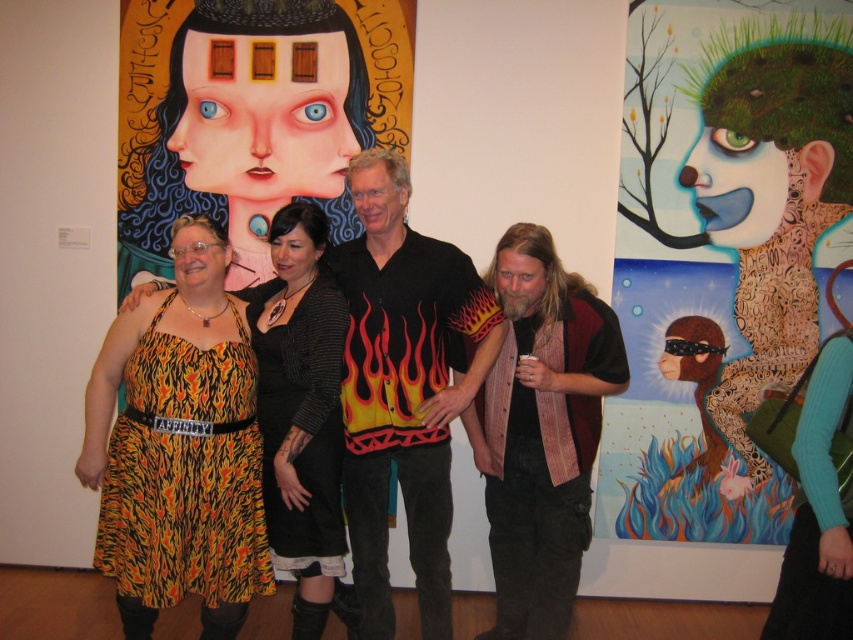
Measure the distance between flame-patterned jersey at center and flame-patterned dress at center.

7.40 inches

Looking at this image, does flame-patterned jersey at center appear on the left side of flame-patterned dress at center?

No, flame-patterned jersey at center is not to the left of flame-patterned dress at center.

Does point (445, 323) come in front of point (289, 468)?

That is False.

Find the location of a particular element. The width and height of the screenshot is (853, 640). flame-patterned jersey at center is located at coordinates (403, 388).

Does flame-patterned jersey at center appear over flannel vest at center?

Yes.

Which is behind, point (374, 512) or point (508, 358)?

Point (508, 358)

Describe the element at coordinates (403, 388) in the screenshot. I see `flame-patterned jersey at center` at that location.

Image resolution: width=853 pixels, height=640 pixels. I want to click on flame-patterned jersey at center, so click(x=403, y=388).

Is flannel vest at center bigger than flame-patterned dress at center?

Yes.

Is flannel vest at center to the right of flame-patterned dress at center from the viewer's perspective?

Yes, flannel vest at center is to the right of flame-patterned dress at center.

Does point (529, 336) come behind point (338, 428)?

Yes, point (529, 336) is farther from viewer.

Where is `flannel vest at center`? The image size is (853, 640). flannel vest at center is located at coordinates (541, 429).